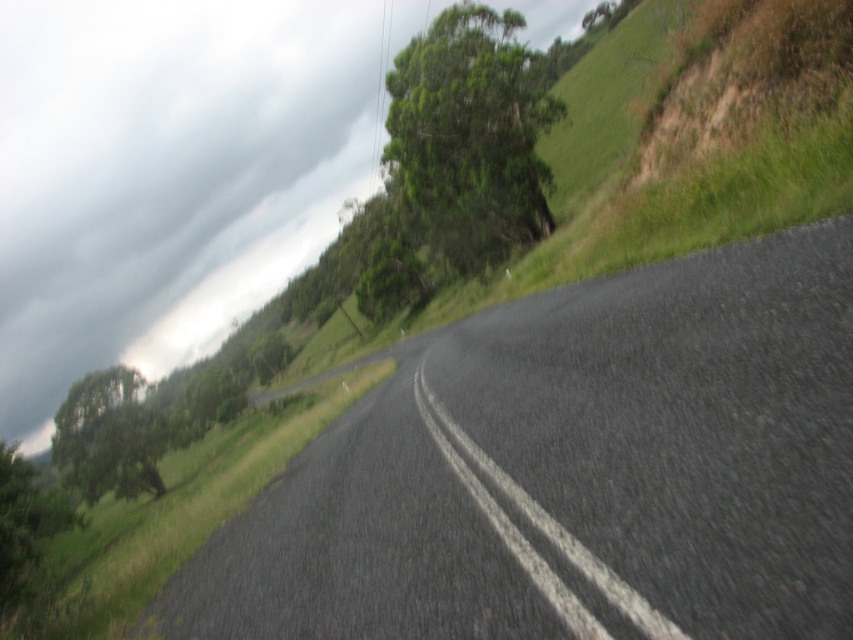
You are a hiker standing at the starting point of the gray asphalt road at center. You want to reach the green leafy tree at upper left. Which direction should you walk to get closer to the tree?

The green leafy tree at upper left is located at the upper left side of the image, so you should walk towards the upper left direction to get closer to it.

You are a driver approaching the green leafy tree at upper center and the gray asphalt road at center. Which object will appear larger in your view as you get closer?

The green leafy tree at upper center will appear larger in your view as you get closer because it is much taller than the gray asphalt road at center.